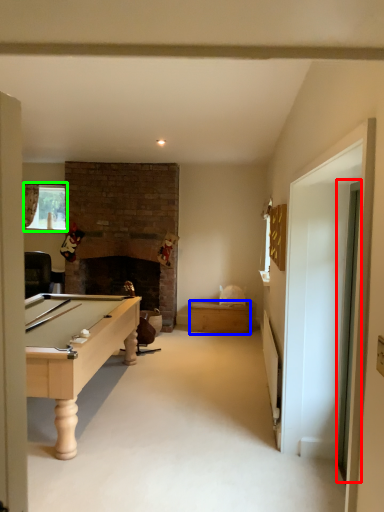
Question: Which is nearer to the glass door (highlighted by a red box)? drawer (highlighted by a blue box) or window (highlighted by a green box).

Choices:
 (A) drawer
 (B) window

Answer: (A)